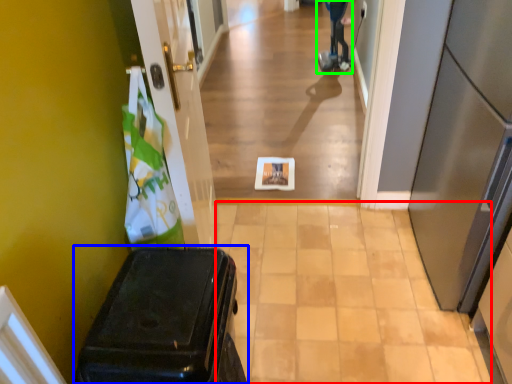
Question: Based on their relative distances, which object is farther from path (highlighted by a red box)? Choose from suitcase (highlighted by a blue box) and mobility scooter (highlighted by a green box).

Choices:
 (A) suitcase
 (B) mobility scooter

Answer: (B)